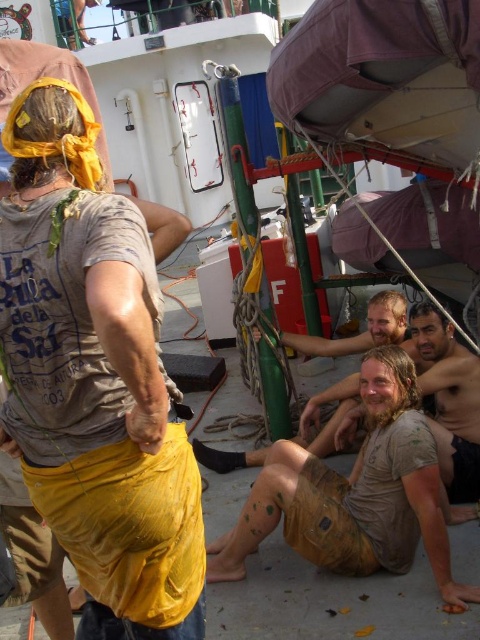
Does point (428, 454) come behind point (474, 413)?

That is False.

What do you see at coordinates (355, 493) in the screenshot? The height and width of the screenshot is (640, 480). I see `brown textured shorts at lower center` at bounding box center [355, 493].

Which is in front, point (240, 547) or point (468, 467)?

Point (240, 547) is in front.

At what (x,y) coordinates should I click in order to perform the action: click on brown textured shorts at lower center. Please return your answer as a coordinate pair (x, y). Image resolution: width=480 pixels, height=640 pixels. Looking at the image, I should click on (355, 493).

Between yellow fabric at center and dirty beige shorts at lower right, which one appears on the left side from the viewer's perspective?

From the viewer's perspective, yellow fabric at center appears more on the left side.

What do you see at coordinates (95, 380) in the screenshot?
I see `yellow fabric at center` at bounding box center [95, 380].

Image resolution: width=480 pixels, height=640 pixels. I want to click on yellow fabric at center, so [95, 380].

Is point (84, 204) closer to viewer compared to point (409, 499)?

Yes, it is in front of point (409, 499).

Based on the photo, is yellow fabric at center taller than brown textured shorts at lower center?

Indeed, yellow fabric at center has a greater height compared to brown textured shorts at lower center.

Is point (67, 93) positioned in front of point (216, 552)?

Yes, it is in front of point (216, 552).

In order to click on yellow fabric at center in this screenshot , I will do `click(95, 380)`.